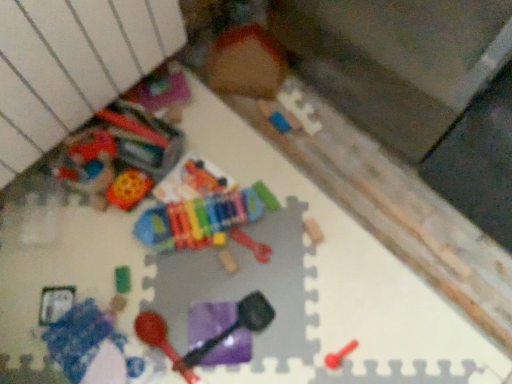
Question: Considering the relative sizes of rubber bone at center, the 6th toy when ordered from left to right, and rubberized plastic maraca at lower center, which ranks as the 2th toy in left-to-right order, in the image provided, is rubber bone at center, the 6th toy when ordered from left to right, wider than rubberized plastic maraca at lower center, which ranks as the 2th toy in left-to-right order,?

Choices:
 (A) yes
 (B) no

Answer: (B)

Question: From a real-world perspective, is rubber bone at center, the 2th toy viewed from the right, physically above rubberized plastic maraca at lower center, which ranks as the 2th toy in left-to-right order?

Choices:
 (A) no
 (B) yes

Answer: (A)

Question: Considering the relative sizes of rubber bone at center, the 6th toy when ordered from left to right, and rubberized plastic maraca at lower center, arranged as the 6th toy when viewed from the right, in the image provided, is rubber bone at center, the 6th toy when ordered from left to right, shorter than rubberized plastic maraca at lower center, arranged as the 6th toy when viewed from the right,?

Choices:
 (A) no
 (B) yes

Answer: (B)

Question: Are rubber bone at center, the 2th toy viewed from the right, and rubberized plastic maraca at lower center, arranged as the 6th toy when viewed from the right, far apart?

Choices:
 (A) yes
 (B) no

Answer: (B)

Question: Considering the relative sizes of rubber bone at center, the 2th toy viewed from the right, and rubberized plastic maraca at lower center, arranged as the 6th toy when viewed from the right, in the image provided, is rubber bone at center, the 2th toy viewed from the right, smaller than rubberized plastic maraca at lower center, arranged as the 6th toy when viewed from the right,?

Choices:
 (A) yes
 (B) no

Answer: (A)

Question: Is smooth plastic spoon at lower right, arranged as the first toy when viewed from the right, situated inside multicolored plastic xylophone at center, the third toy from the left, or outside?

Choices:
 (A) inside
 (B) outside

Answer: (B)

Question: From the image's perspective, is smooth plastic spoon at lower right, the seventh toy in the left-to-right sequence, above or below multicolored plastic xylophone at center, the fifth toy from the right?

Choices:
 (A) below
 (B) above

Answer: (A)

Question: From a real-world perspective, is smooth plastic spoon at lower right, the seventh toy in the left-to-right sequence, above or below multicolored plastic xylophone at center, the third toy from the left?

Choices:
 (A) above
 (B) below

Answer: (B)

Question: Is smooth plastic spoon at lower right, the seventh toy in the left-to-right sequence, wider or thinner than multicolored plastic xylophone at center, the fifth toy from the right?

Choices:
 (A) wide
 (B) thin

Answer: (B)

Question: Is rubber bone at center, the 6th toy when ordered from left to right, inside or outside of wooden xylophone at center, which ranks as the fourth toy in right-to-left order?

Choices:
 (A) outside
 (B) inside

Answer: (A)

Question: Is rubber bone at center, the 2th toy viewed from the right, to the left or to the right of wooden xylophone at center, which is the 4th toy from left to right, in the image?

Choices:
 (A) right
 (B) left

Answer: (A)

Question: Considering the positions of rubber bone at center, the 2th toy viewed from the right, and wooden xylophone at center, which is the 4th toy from left to right, in the image, is rubber bone at center, the 2th toy viewed from the right, wider or thinner than wooden xylophone at center, which is the 4th toy from left to right,?

Choices:
 (A) thin
 (B) wide

Answer: (B)

Question: In the image, is rubber bone at center, the 2th toy viewed from the right, positioned in front of or behind wooden xylophone at center, which is the 4th toy from left to right?

Choices:
 (A) front
 (B) behind

Answer: (B)

Question: Is blue fabric blanket at lower left, positioned as the first toy in left-to-right order, in front of or behind wooden xylophone at center, which ranks as the fourth toy in right-to-left order, in the image?

Choices:
 (A) front
 (B) behind

Answer: (A)

Question: Visually, is blue fabric blanket at lower left, positioned as the first toy in left-to-right order, positioned to the left or to the right of wooden xylophone at center, which ranks as the fourth toy in right-to-left order?

Choices:
 (A) right
 (B) left

Answer: (B)